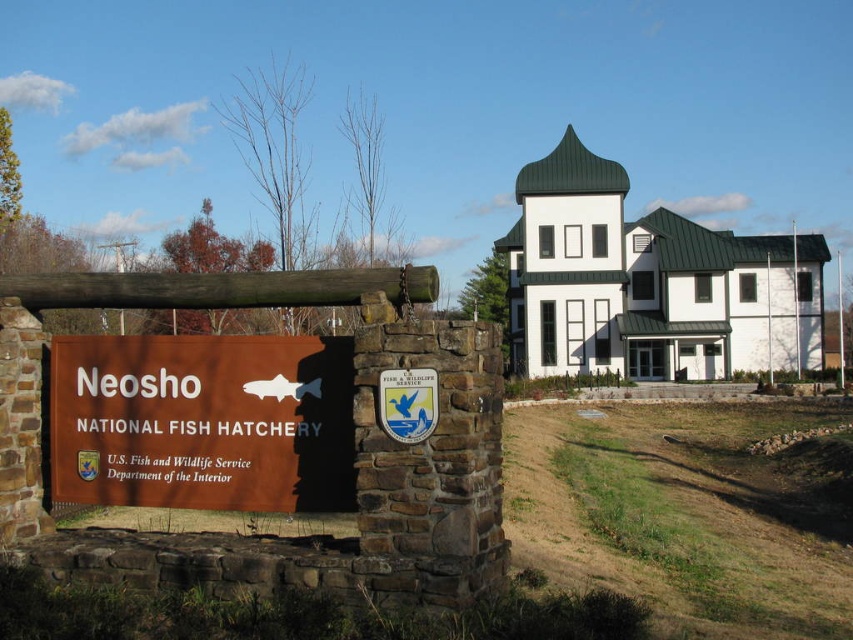
Question: Can you confirm if brown matte sign at center is positioned to the left of white glass door at center?

Choices:
 (A) yes
 (B) no

Answer: (A)

Question: Which object is farther from the camera taking this photo?

Choices:
 (A) white glass door at center
 (B) brown matte sign at center

Answer: (A)

Question: Is the position of brown matte sign at center less distant than that of white glass door at center?

Choices:
 (A) no
 (B) yes

Answer: (B)

Question: Which of the following is the farthest from the observer?

Choices:
 (A) brown matte sign at center
 (B) white glass door at center

Answer: (B)

Question: Which point appears farthest from the camera in this image?

Choices:
 (A) (287, 445)
 (B) (631, 369)

Answer: (B)

Question: Is brown matte sign at center closer to the viewer compared to white glass door at center?

Choices:
 (A) yes
 (B) no

Answer: (A)